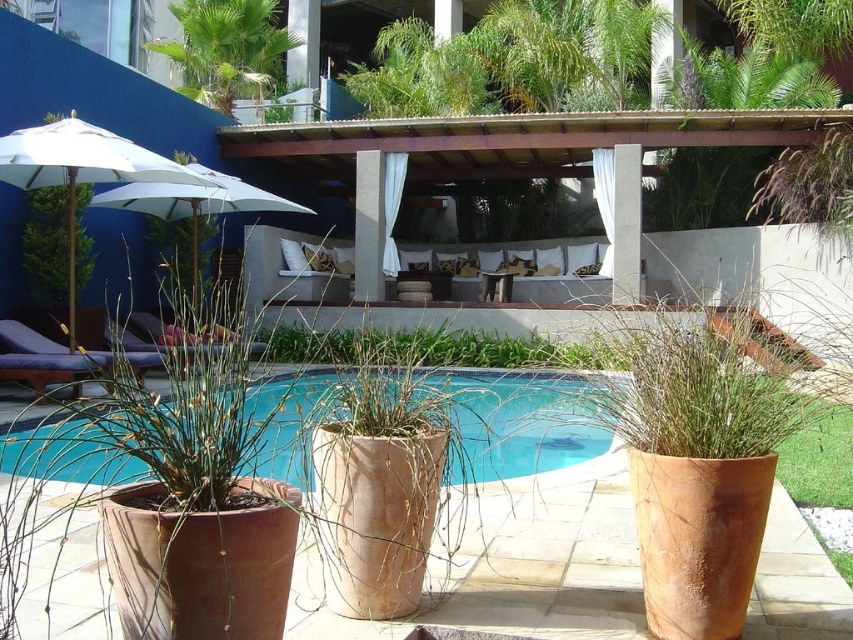
Question: Which of the following is the farthest from the observer?

Choices:
 (A) blue ceramic swimming pool at center
 (B) matte white lounge at lower left
 (C) white concrete pillar at center
 (D) white fabric umbrella at left

Answer: (B)

Question: Is blue ceramic swimming pool at center to the left of white concrete pillar at center from the viewer's perspective?

Choices:
 (A) yes
 (B) no

Answer: (B)

Question: Does matte white lounge at lower left have a larger size compared to blue ceramic swimming pool at center?

Choices:
 (A) yes
 (B) no

Answer: (B)

Question: Among these points, which one is nearest to the camera?

Choices:
 (A) (473, 442)
 (B) (170, 180)
 (C) (370, 275)
 (D) (144, 188)

Answer: (A)

Question: Is green leafy palm tree at upper left above white fabric umbrella at left?

Choices:
 (A) yes
 (B) no

Answer: (A)

Question: Which object appears closest to the camera in this image?

Choices:
 (A) matte white lounge at lower left
 (B) blue ceramic swimming pool at center
 (C) white concrete pillar at center

Answer: (B)